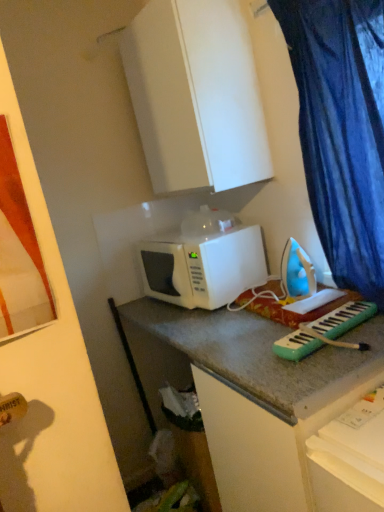
Find the location of a particular element. The width and height of the screenshot is (384, 512). vacant point above green plastic keyboard at center-right (from a real-world perspective) is located at coordinates point(326,317).